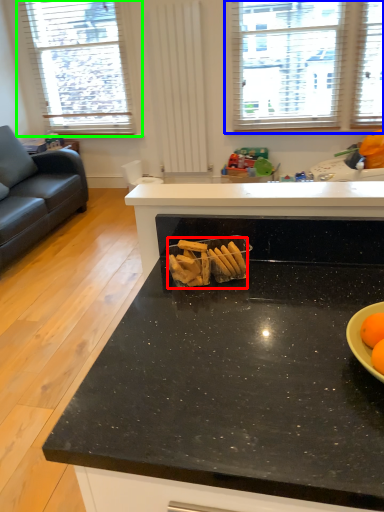
Question: Which object is positioned farthest from snack (highlighted by a red box)? Select from window (highlighted by a blue box) and window (highlighted by a green box).

Choices:
 (A) window
 (B) window

Answer: (B)